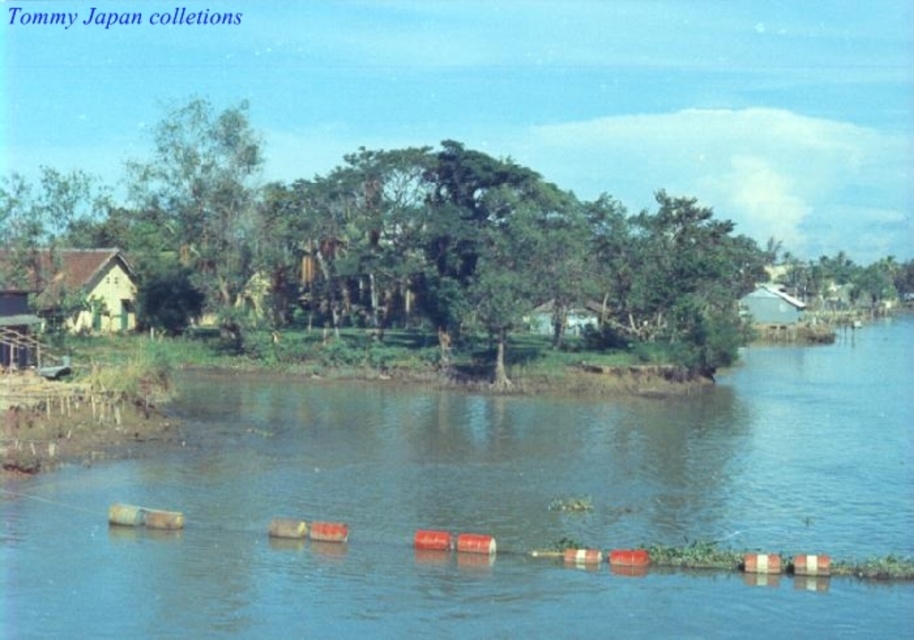
Does point (441, 342) lie behind point (764, 300)?

No, it is in front of (764, 300).

In the scene shown: Which is more to the left, green leafy tree at center or white matte hut at upper right?

green leafy tree at center

Is point (362, 228) closer to viewer compared to point (763, 285)?

Yes, point (362, 228) is closer to viewer.

The width and height of the screenshot is (914, 640). In order to click on green leafy tree at center in this screenshot , I will do `click(392, 243)`.

Can you confirm if yellow matte hut at left is positioned above white matte hut at upper right?

Actually, yellow matte hut at left is below white matte hut at upper right.

Which is behind, point (107, 289) or point (792, 300)?

Point (792, 300)

Is point (119, 285) closer to viewer compared to point (761, 301)?

Yes, it is.

You are a GUI agent. You are given a task and a screenshot of the screen. Output one action in this format:
    pyautogui.click(x=<x>, y=<y>)
    Task: Click on the yellow matte hut at left
    This screenshot has height=640, width=914.
    Given the screenshot: What is the action you would take?
    pyautogui.click(x=76, y=284)

Between point (444, 397) and point (841, 282), which one is positioned in front?

Point (444, 397)

Can you confirm if smooth concrete river at center is taller than green leafy tree at upper right?

No, smooth concrete river at center is not taller than green leafy tree at upper right.

Which is in front, point (433, 472) or point (847, 260)?

Point (433, 472) is in front.

Where is `smooth concrete river at center`? This screenshot has height=640, width=914. smooth concrete river at center is located at coordinates (485, 509).